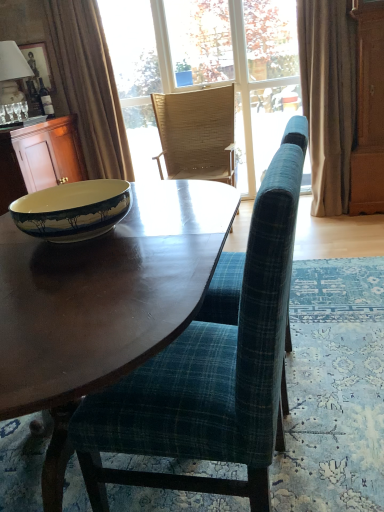
Identify the location of free space in front of wooden screen door at right. The image size is (384, 512). (362, 223).